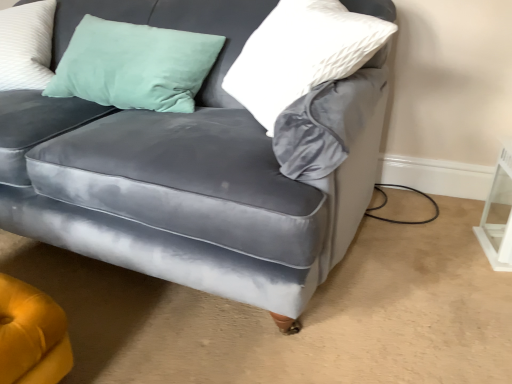
Question: Can you confirm if white textured pillow at upper right is positioned to the left of velvet gray couch at center?

Choices:
 (A) yes
 (B) no

Answer: (B)

Question: Is white textured pillow at upper right touching velvet gray couch at center?

Choices:
 (A) yes
 (B) no

Answer: (B)

Question: Would you say white textured pillow at upper right contains velvet gray couch at center?

Choices:
 (A) yes
 (B) no

Answer: (B)

Question: Is the depth of white textured pillow at upper right greater than that of velvet gray couch at center?

Choices:
 (A) yes
 (B) no

Answer: (A)

Question: Considering the relative sizes of white textured pillow at upper right and velvet gray couch at center in the image provided, is white textured pillow at upper right taller than velvet gray couch at center?

Choices:
 (A) no
 (B) yes

Answer: (A)

Question: Is point (291, 82) closer or farther from the camera than point (99, 243)?

Choices:
 (A) closer
 (B) farther

Answer: (A)

Question: Based on their positions, is white textured pillow at upper right located to the left or right of velvet gray couch at center?

Choices:
 (A) left
 (B) right

Answer: (B)

Question: Considering the positions of white textured pillow at upper right and velvet gray couch at center in the image, is white textured pillow at upper right taller or shorter than velvet gray couch at center?

Choices:
 (A) tall
 (B) short

Answer: (B)

Question: Considering the positions of white textured pillow at upper right and velvet gray couch at center in the image, is white textured pillow at upper right wider or thinner than velvet gray couch at center?

Choices:
 (A) wide
 (B) thin

Answer: (B)

Question: Considering the positions of white glossy table at lower right and white textured pillow at upper right in the image, is white glossy table at lower right taller or shorter than white textured pillow at upper right?

Choices:
 (A) short
 (B) tall

Answer: (A)

Question: From the image's perspective, is white glossy table at lower right positioned above or below white textured pillow at upper right?

Choices:
 (A) above
 (B) below

Answer: (B)

Question: Is white glossy table at lower right situated inside white textured pillow at upper right or outside?

Choices:
 (A) inside
 (B) outside

Answer: (B)

Question: Is white glossy table at lower right in front of or behind white textured pillow at upper right in the image?

Choices:
 (A) front
 (B) behind

Answer: (B)

Question: Is velvet gray couch at center taller or shorter than white glossy table at lower right?

Choices:
 (A) short
 (B) tall

Answer: (B)

Question: Does point (339, 192) appear closer or farther from the camera than point (503, 180)?

Choices:
 (A) closer
 (B) farther

Answer: (A)